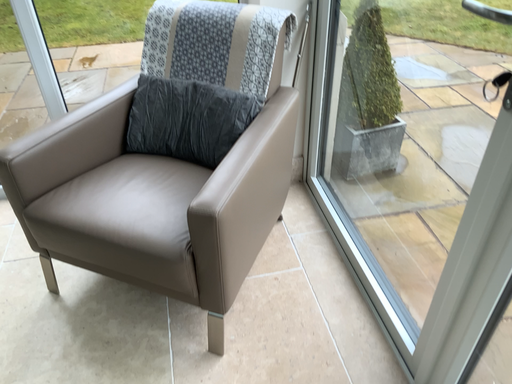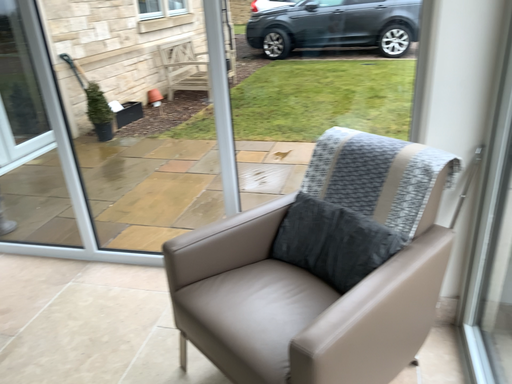
Question: How did the camera likely rotate when shooting the video?

Choices:
 (A) rotated right
 (B) rotated left

Answer: (B)